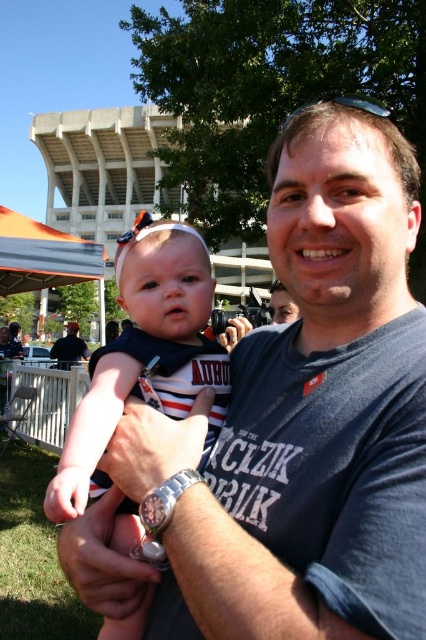
Question: Can you confirm if dark blue t-shirt at center is positioned to the right of striped jersey baby at center?

Choices:
 (A) yes
 (B) no

Answer: (A)

Question: Does dark blue t-shirt at center have a lesser width compared to striped jersey baby at center?

Choices:
 (A) yes
 (B) no

Answer: (A)

Question: Can you confirm if striped jersey baby at center is positioned below black cotton shirt at center?

Choices:
 (A) no
 (B) yes

Answer: (B)

Question: Which point appears farthest from the camera in this image?

Choices:
 (A) (173, 369)
 (B) (377, 216)
 (C) (63, 346)

Answer: (C)

Question: Which point appears closest to the camera in this image?

Choices:
 (A) (166, 259)
 (B) (54, 358)

Answer: (A)

Question: Which object appears farthest from the camera in this image?

Choices:
 (A) black cotton shirt at center
 (B) striped jersey baby at center

Answer: (A)